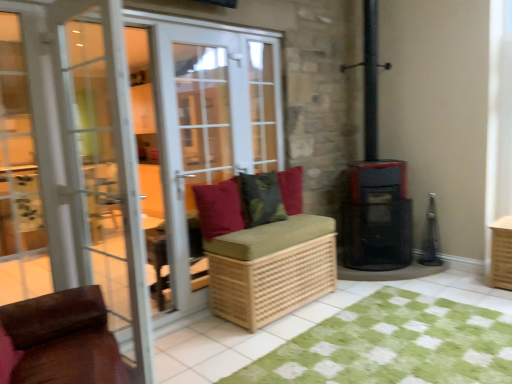
Measure the distance between white glass screen door at left, arranged as the 1th screen door when viewed from the front, and camera.

6.15 feet.

What do you see at coordinates (219, 208) in the screenshot? The width and height of the screenshot is (512, 384). I see `velvet red pillow at center, the 3th pillow in the right-to-left sequence` at bounding box center [219, 208].

What is the approximate height of white glass door at center?

It is 6.89 feet.

What do you see at coordinates (264, 254) in the screenshot?
I see `woven wood bench at center` at bounding box center [264, 254].

The height and width of the screenshot is (384, 512). What do you see at coordinates (291, 189) in the screenshot?
I see `velvet-like green cushion at center, the third pillow viewed from the left` at bounding box center [291, 189].

The width and height of the screenshot is (512, 384). I want to click on wooden crate at right, so click(x=501, y=253).

Find the location of a particular element. The image size is (512, 384). matte black stove at right is located at coordinates (377, 218).

Where is `white glass screen door at left, arranged as the 1th screen door when viewed from the front`? white glass screen door at left, arranged as the 1th screen door when viewed from the front is located at coordinates (105, 165).

Which is more to the right, matte black stove at right or white glass door at center?

Positioned to the right is matte black stove at right.

Based on the photo, which of these two, matte black stove at right or white glass door at center, stands taller?

white glass door at center.

From the image's perspective, is matte black stove at right positioned above or below white glass door at center?

From the image's perspective, matte black stove at right appears below white glass door at center.

In the scene shown: Are wooden crate at right and white glass door at center beside each other?

wooden crate at right and white glass door at center are clearly separated.

From the image's perspective, between wooden crate at right and white glass door at center, who is located below?

wooden crate at right.

Is wooden crate at right spatially inside white glass door at center, or outside of it?

wooden crate at right is not inside white glass door at center, it's outside.

Is point (508, 232) closer to camera compared to point (236, 129)?

Yes, point (508, 232) is closer to viewer.

Is white glass door at center beside wooden crate at right?

No, white glass door at center is not touching wooden crate at right.

Which is more to the left, white glass door at center or wooden crate at right?

From the viewer's perspective, white glass door at center appears more on the left side.

From the image's perspective, relative to wooden crate at right, is white glass door at center above or below?

From the image's perspective, white glass door at center appears above wooden crate at right.

From a real-world perspective, between white glass door at center and wooden crate at right, who is vertically lower?

From a 3D spatial view, wooden crate at right is below.

Is woven wood bench at center to the right of velvet-like green cushion at center, which appears as the first pillow when viewed from the right, from the viewer's perspective?

No, woven wood bench at center is not to the right of velvet-like green cushion at center, which appears as the first pillow when viewed from the right.

Between woven wood bench at center and velvet-like green cushion at center, the third pillow viewed from the left, which one has less height?

With less height is velvet-like green cushion at center, the third pillow viewed from the left.

Could you tell me if woven wood bench at center is facing velvet-like green cushion at center, which appears as the first pillow when viewed from the right?

No, woven wood bench at center does not turn towards velvet-like green cushion at center, which appears as the first pillow when viewed from the right.

From the image's perspective, is woven wood bench at center above or below velvet-like green cushion at center, which appears as the first pillow when viewed from the right?

From the image's perspective, woven wood bench at center appears below velvet-like green cushion at center, which appears as the first pillow when viewed from the right.

Is white glass screen door at left, arranged as the 1th screen door when viewed from the front, not close to velvet red pillow at center, the first pillow positioned from the left?

No, white glass screen door at left, arranged as the 1th screen door when viewed from the front, is in close proximity to velvet red pillow at center, the first pillow positioned from the left.

From a real-world perspective, relative to velvet red pillow at center, the 3th pillow in the right-to-left sequence, is white glass screen door at left, arranged as the 1th screen door when viewed from the front, vertically above or below?

In terms of real-world spatial position, white glass screen door at left, arranged as the 1th screen door when viewed from the front, is above velvet red pillow at center, the 3th pillow in the right-to-left sequence.

Measure the distance between white glass screen door at left, arranged as the 1th screen door when viewed from the front, and velvet red pillow at center, the first pillow positioned from the left.

They are 38.87 inches apart.

Consider the image. What's the angular difference between white glass screen door at left, the second screen door from the back, and velvet red pillow at center, the first pillow positioned from the left,'s facing directions?

90.6 degrees separate the facing orientations of white glass screen door at left, the second screen door from the back, and velvet red pillow at center, the first pillow positioned from the left.

From the image's perspective, which one is positioned lower, green textured cushion at center, placed as the 2th pillow when sorted from right to left, or matte white screen door at center, which is counted as the 2th screen door, starting from the front?

green textured cushion at center, placed as the 2th pillow when sorted from right to left, appears lower in the image.

Does green textured cushion at center, placed as the 2th pillow when sorted from left to right, have a greater width compared to matte white screen door at center, which is counted as the 2th screen door, starting from the front?

Correct, the width of green textured cushion at center, placed as the 2th pillow when sorted from left to right, exceeds that of matte white screen door at center, which is counted as the 2th screen door, starting from the front.

Where is `the 2nd pillow counting from the right side of the matte white screen door at center, which is the first screen door from back to front`? The height and width of the screenshot is (384, 512). the 2nd pillow counting from the right side of the matte white screen door at center, which is the first screen door from back to front is located at coordinates (261, 199).

Which is closer, [277,208] or [195,210]?

The point [195,210] is closer.

Does white glass door at center lie behind velvet red pillow at center, the first pillow positioned from the left?

No, white glass door at center is in front of velvet red pillow at center, the first pillow positioned from the left.

Which object is positioned more to the left, white glass door at center or velvet red pillow at center, the 3th pillow in the right-to-left sequence?

From the viewer's perspective, white glass door at center appears more on the left side.

The image size is (512, 384). In order to click on the 3rd pillow below the white glass door at center (from the image's perspective) in this screenshot , I will do tap(219, 208).

Which is behind, point (195, 128) or point (224, 234)?

The point (224, 234) is behind.

Locate an element on the screen. appliance behind the white glass door at center is located at coordinates (377, 218).

The height and width of the screenshot is (384, 512). Identify the location of door above the wooden crate at right (from the image's perspective). (161, 144).

Based on their spatial positions, is velvet-like green cushion at center, the third pillow viewed from the left, or white glass screen door at left, arranged as the 1th screen door when viewed from the front, closer to matte black stove at right?

Based on the image, velvet-like green cushion at center, the third pillow viewed from the left, appears to be nearer to matte black stove at right.

Which object lies further to the anchor point woven wood bench at center, velvet-like green cushion at center, the third pillow viewed from the left, or wooden crate at right?

Based on the image, wooden crate at right appears to be further to woven wood bench at center.

Considering their positions, is velvet-like green cushion at center, the third pillow viewed from the left, positioned further to matte black stove at right than matte white screen door at center, which is counted as the 2th screen door, starting from the front?

matte white screen door at center, which is counted as the 2th screen door, starting from the front, lies further to matte black stove at right than the other object.

From the image, which object appears to be farther from velvet red pillow at center, the 3th pillow in the right-to-left sequence, woven wood bench at center or green textured cushion at center, placed as the 2th pillow when sorted from right to left?

Among the two, woven wood bench at center is located further to velvet red pillow at center, the 3th pillow in the right-to-left sequence.

Considering their positions, is woven wood bench at center positioned closer to velvet red pillow at center, the 3th pillow in the right-to-left sequence, than velvet-like green cushion at center, the third pillow viewed from the left?

woven wood bench at center lies closer to velvet red pillow at center, the 3th pillow in the right-to-left sequence, than the other object.

When comparing their distances from woven wood bench at center, does wooden crate at right or white glass screen door at left, the second screen door from the back, seem closer?

Based on the image, white glass screen door at left, the second screen door from the back, appears to be nearer to woven wood bench at center.

Estimate the real-world distances between objects in this image. Which object is further from white glass screen door at left, the second screen door from the back, wooden crate at right or velvet red pillow at center, the 3th pillow in the right-to-left sequence?

wooden crate at right.

Which object lies further to the anchor point green textured cushion at center, placed as the 2th pillow when sorted from right to left, matte black stove at right or green checkered rug at lower center?

green checkered rug at lower center is further to green textured cushion at center, placed as the 2th pillow when sorted from right to left.

Where is `screen door positioned between white glass door at center and velvet-like green cushion at center, the third pillow viewed from the left, from near to far`? Image resolution: width=512 pixels, height=384 pixels. screen door positioned between white glass door at center and velvet-like green cushion at center, the third pillow viewed from the left, from near to far is located at coordinates (210, 132).

This screenshot has height=384, width=512. I want to click on pillow located between white glass screen door at left, the second screen door from the back, and green textured cushion at center, placed as the 2th pillow when sorted from right to left, in the depth direction, so click(219, 208).

You are a GUI agent. You are given a task and a screenshot of the screen. Output one action in this format:
    pyautogui.click(x=<x>, y=<y>)
    Task: Click on the door between white glass screen door at left, the second screen door from the back, and matte white screen door at center, which is the first screen door from back to front, in the front-back direction
    The height and width of the screenshot is (384, 512).
    Given the screenshot: What is the action you would take?
    pyautogui.click(x=161, y=144)

Locate an element on the screen. Image resolution: width=512 pixels, height=384 pixels. screen door positioned between white glass door at center and velvet red pillow at center, the first pillow positioned from the left, from near to far is located at coordinates (210, 132).